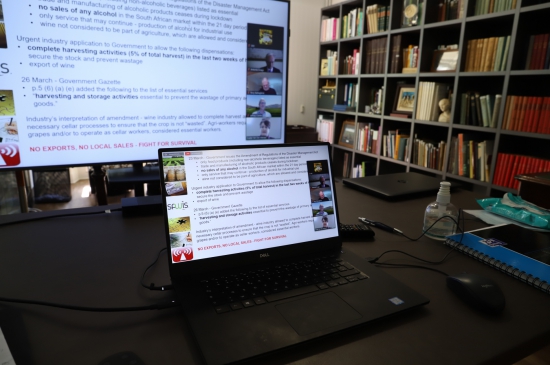
Find the location of `laptop screen`. laptop screen is located at coordinates (244, 206).